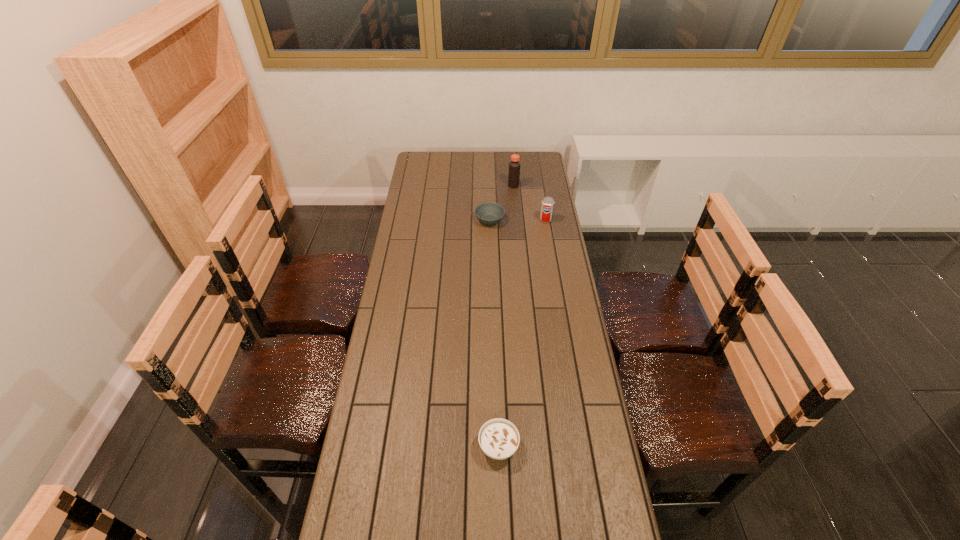
Where is `object that is positioned at the right edge`? The image size is (960, 540). object that is positioned at the right edge is located at coordinates click(x=547, y=206).

This screenshot has width=960, height=540. Identify the location of vacant point at the far edge. (506, 152).

Find the location of a particular element. This screenshot has height=540, width=960. vacant space at the left edge is located at coordinates click(410, 204).

This screenshot has width=960, height=540. In the image, there is a desktop. In order to click on free space at the right edge in this screenshot , I will do `click(531, 261)`.

Where is `vacant space at the far right corner of the desktop`? The image size is (960, 540). vacant space at the far right corner of the desktop is located at coordinates (528, 167).

In order to click on vacant area that lies between the nearest object and the second tallest object in this screenshot , I will do `click(522, 333)`.

The width and height of the screenshot is (960, 540). Find the location of `unoccupied area between the rightmost object and the nearer soup bowl`. unoccupied area between the rightmost object and the nearer soup bowl is located at coordinates (522, 333).

In order to click on unoccupied area between the second tallest object and the nearest object in this screenshot , I will do `click(522, 333)`.

Where is `vacant space that is in between the nearer soup bowl and the farther soup bowl`? This screenshot has height=540, width=960. vacant space that is in between the nearer soup bowl and the farther soup bowl is located at coordinates (494, 333).

The width and height of the screenshot is (960, 540). Identify the location of free area in between the nearest object and the farther soup bowl. (494, 333).